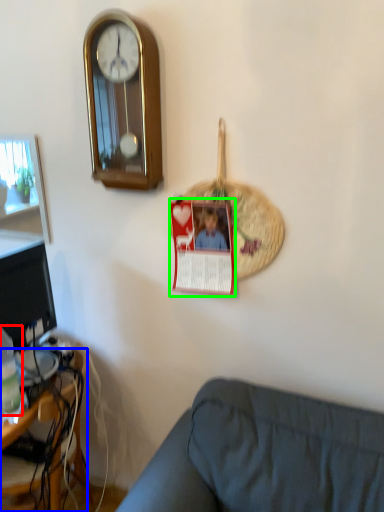
Question: Which is nearer to the bottle (highlighted by a red box)? desk (highlighted by a blue box) or postcard (highlighted by a green box).

Choices:
 (A) desk
 (B) postcard

Answer: (A)